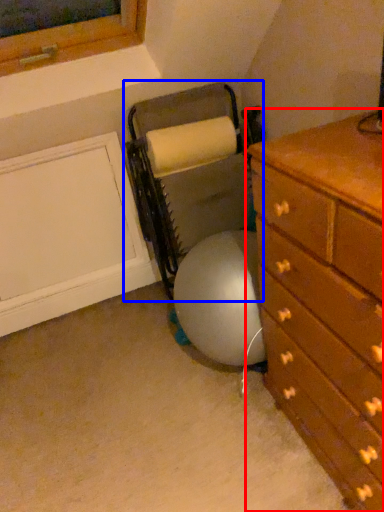
Question: Which object appears farthest to the camera in this image, chest of drawers (highlighted by a red box) or bean bag chair (highlighted by a blue box)?

Choices:
 (A) chest of drawers
 (B) bean bag chair

Answer: (B)